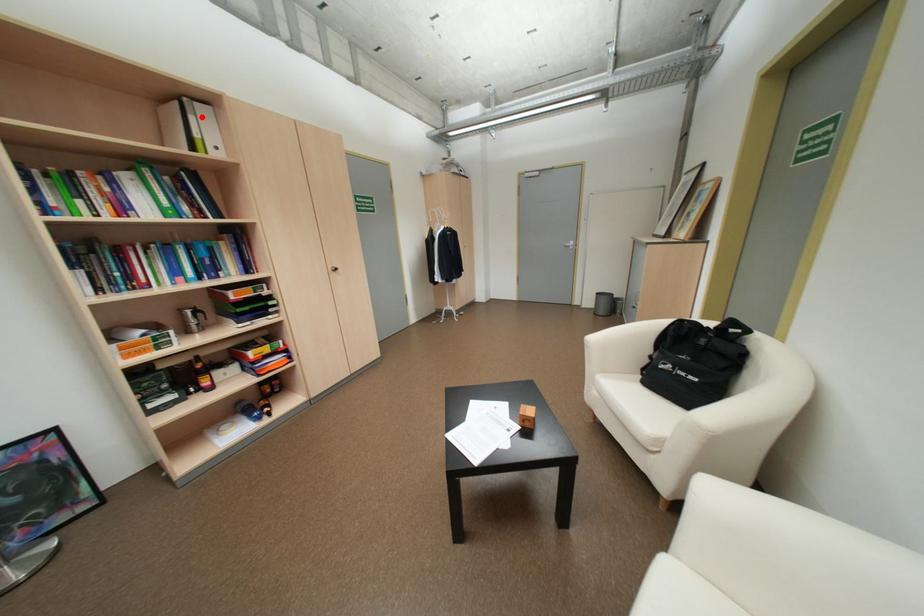
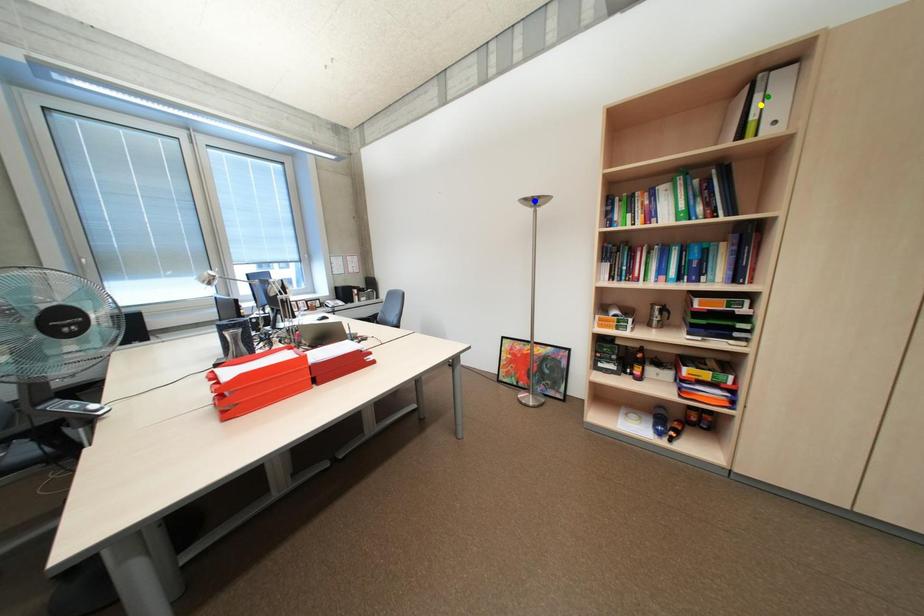
Question: I am providing you with two images of the same scene from different viewpoints. A red point is marked on the first image. You are given multiple points on the second image. In image 2, which mark is for the same physical point as the one in image 1?

Choices:
 (A) yellow point
 (B) blue point
 (C) green point

Answer: (C)